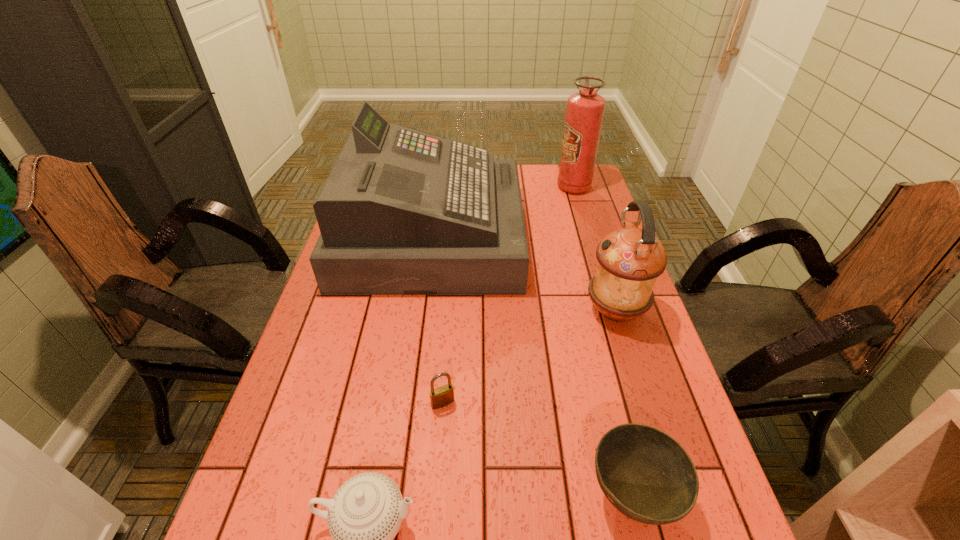
Identify the location of fire extinguisher that is at the far edge. (585, 110).

Image resolution: width=960 pixels, height=540 pixels. Find the location of `cash register located in the far edge section of the desktop`. cash register located in the far edge section of the desktop is located at coordinates (402, 212).

Where is `object present at the left edge`? This screenshot has height=540, width=960. object present at the left edge is located at coordinates [402, 212].

You are a GUI agent. You are given a task and a screenshot of the screen. Output one action in this format:
    pyautogui.click(x=<x>, y=<y>)
    Task: Click on the fire extinguisher located in the right edge section of the desktop
    
    Given the screenshot: What is the action you would take?
    pyautogui.click(x=585, y=110)

This screenshot has height=540, width=960. What are the coordinates of `oil lamp at the right edge` in the screenshot? It's located at (630, 259).

What are the coordinates of `object at the far left corner` in the screenshot? It's located at (402, 212).

The height and width of the screenshot is (540, 960). Find the location of `object present at the far right corner`. object present at the far right corner is located at coordinates (585, 110).

Identify the location of vacant area at the right edge. The image size is (960, 540). click(564, 225).

Find the location of `empty location between the oil lamp and the fire extinguisher`. empty location between the oil lamp and the fire extinguisher is located at coordinates (594, 249).

Identify which object is located as the nearest to the padlock. Please provide its 2D coordinates. Your answer should be formatted as a tuple, i.e. [(x, y)], where the tuple contains the x and y coordinates of a point satisfying the conditions above.

[(365, 514)]